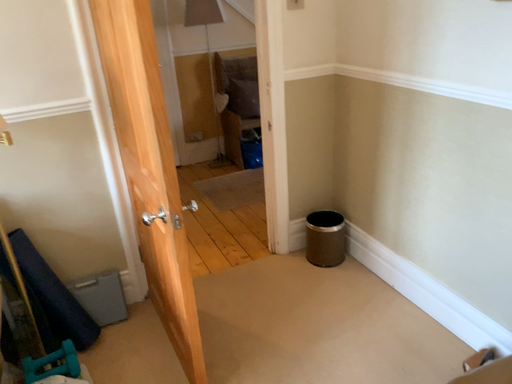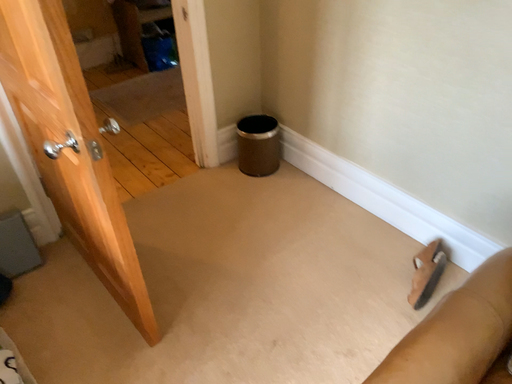
Question: How did the camera likely rotate when shooting the video?

Choices:
 (A) rotated downward
 (B) rotated upward

Answer: (A)